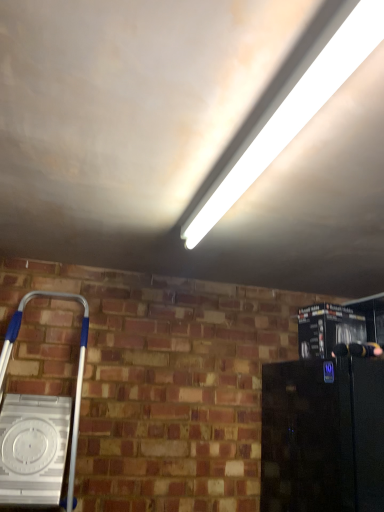
Question: From a real-world perspective, is white fluorescent tube at upper center above or below black glossy refrigerator at lower right, which is the first appliance in bottom-to-top order?

Choices:
 (A) below
 (B) above

Answer: (B)

Question: Is white fluorescent tube at upper center in front of or behind black glossy refrigerator at lower right, placed as the 2th appliance when sorted from top to bottom, in the image?

Choices:
 (A) behind
 (B) front

Answer: (B)

Question: Which object is the farthest from the metallic black coffee maker at right, the first appliance when ordered from top to bottom?

Choices:
 (A) silver metallic ladder at lower left
 (B) black glossy refrigerator at lower right, which is the first appliance in bottom-to-top order
 (C) white fluorescent tube at upper center

Answer: (A)

Question: Which of these objects is positioned closest to the silver metallic ladder at lower left?

Choices:
 (A) metallic black coffee maker at right, the first appliance when ordered from top to bottom
 (B) white fluorescent tube at upper center
 (C) black glossy refrigerator at lower right, placed as the 2th appliance when sorted from top to bottom

Answer: (C)